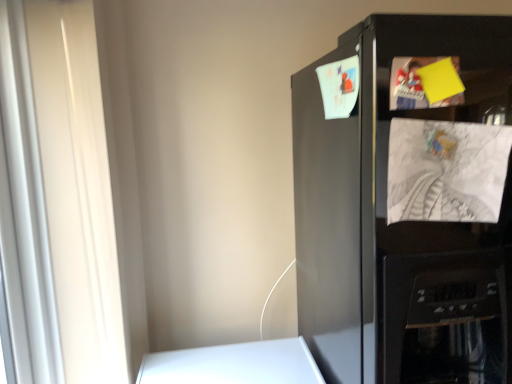
Question: Considering their positions, is white textured paper at right located in front of or behind black matte refrigerator at upper right?

Choices:
 (A) front
 (B) behind

Answer: (B)

Question: From their relative heights in the image, would you say white textured paper at right is taller or shorter than black matte refrigerator at upper right?

Choices:
 (A) short
 (B) tall

Answer: (A)

Question: Considering the positions of white textured paper at right and black matte refrigerator at upper right in the image, is white textured paper at right bigger or smaller than black matte refrigerator at upper right?

Choices:
 (A) big
 (B) small

Answer: (B)

Question: From a real-world perspective, is black matte refrigerator at upper right above or below white textured paper at right?

Choices:
 (A) below
 (B) above

Answer: (A)

Question: Is point (338, 342) closer or farther from the camera than point (482, 213)?

Choices:
 (A) closer
 (B) farther

Answer: (B)

Question: Considering the positions of black matte refrigerator at upper right and white textured paper at right in the image, is black matte refrigerator at upper right wider or thinner than white textured paper at right?

Choices:
 (A) thin
 (B) wide

Answer: (B)

Question: From the image's perspective, is black matte refrigerator at upper right above or below white textured paper at right?

Choices:
 (A) below
 (B) above

Answer: (A)